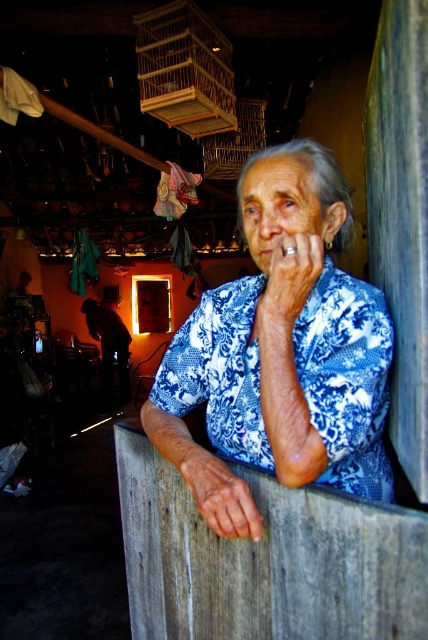
You are an interior designer analyzing the lighting in this room. The blue printed shirt at center and the blue fabric hand at center are both in the light. Which object is more illuminated?

The blue printed shirt at center is closer to the viewer than blue fabric hand at center, so it is more illuminated.

You are an interior designer observing this scene. You notice the blue printed shirt at center and the blue fabric hand at center. Which object is positioned to the right side of the other?

The blue printed shirt at center is to the right of the blue fabric hand at center.